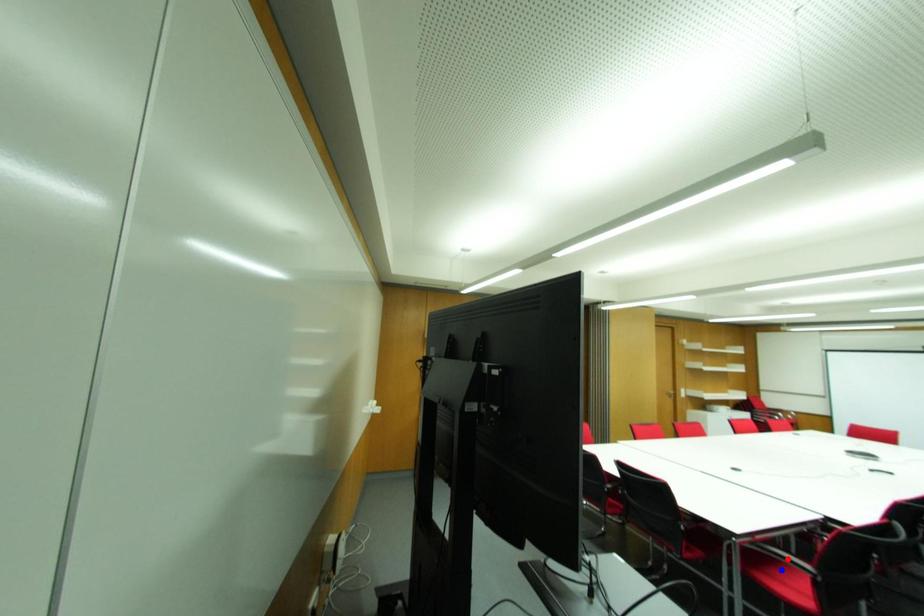
Question: Two points are marked on the image. Which point is closer to the camera?

Choices:
 (A) Blue point is closer.
 (B) Red point is closer.

Answer: (B)